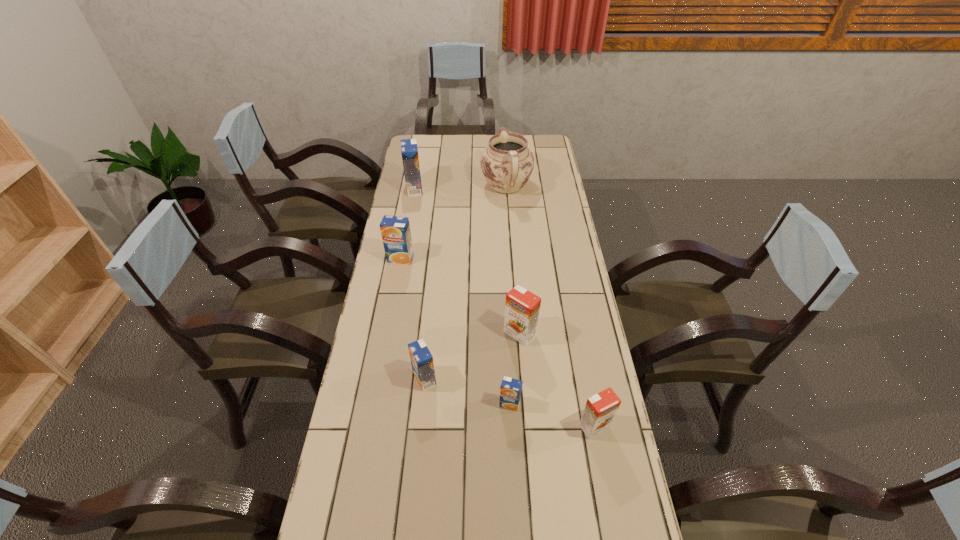
At what (x,y) coordinates should I click in order to perform the action: click on free space located 0.380m on the back of the nearest object. Please return your answer as a coordinate pair (x, y). The height and width of the screenshot is (540, 960). Looking at the image, I should click on (572, 309).

Identify the location of free space located on the front of the rightmost blue orange_juice. This screenshot has width=960, height=540. (516, 537).

The height and width of the screenshot is (540, 960). Identify the location of pitcher at the right edge. (507, 163).

Find the location of `orange juice located at the right edge`. orange juice located at the right edge is located at coordinates (599, 412).

Find the location of a particular element. The width and height of the screenshot is (960, 540). vacant space at the left edge is located at coordinates (398, 403).

This screenshot has height=540, width=960. In order to click on vacant space at the right edge of the desktop in this screenshot , I will do `click(555, 163)`.

Where is `free space at the far left corner of the desktop`? This screenshot has height=540, width=960. free space at the far left corner of the desktop is located at coordinates (427, 140).

Find the location of a particular element. The image size is (960, 540). free space between the third farthest object and the purple pitcher is located at coordinates (453, 222).

Where is `free spot between the smallest blue orange_juice and the farthest blue orange_juice`? The height and width of the screenshot is (540, 960). free spot between the smallest blue orange_juice and the farthest blue orange_juice is located at coordinates (462, 296).

This screenshot has width=960, height=540. What are the coordinates of `unoccupied area between the third farthest orange_juice and the shortest orange_juice` in the screenshot? It's located at [515, 369].